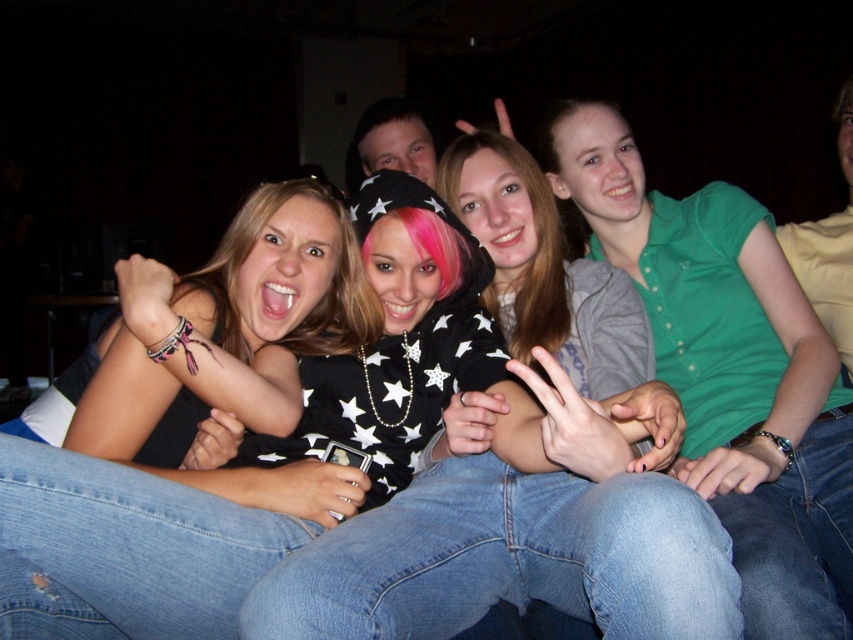
Question: Is ripped denim jeans at lower left further to the viewer compared to jeans at lower right?

Choices:
 (A) yes
 (B) no

Answer: (B)

Question: Which of the following is the farthest from the observer?

Choices:
 (A) ripped denim jeans at lower left
 (B) jeans at lower right
 (C) denim jeans at center

Answer: (B)

Question: Which of the following is the farthest from the observer?

Choices:
 (A) black star-patterned hoodie at center
 (B) ripped denim jeans at lower left

Answer: (A)

Question: Considering the real-world distances, which object is closest to the denim jeans at center?

Choices:
 (A) jeans at lower right
 (B) ripped denim jeans at lower left

Answer: (B)

Question: Is denim jeans at center smaller than jeans at lower right?

Choices:
 (A) yes
 (B) no

Answer: (B)

Question: Can you confirm if black star-patterned hoodie at center is thinner than ripped denim jeans at lower left?

Choices:
 (A) no
 (B) yes

Answer: (A)